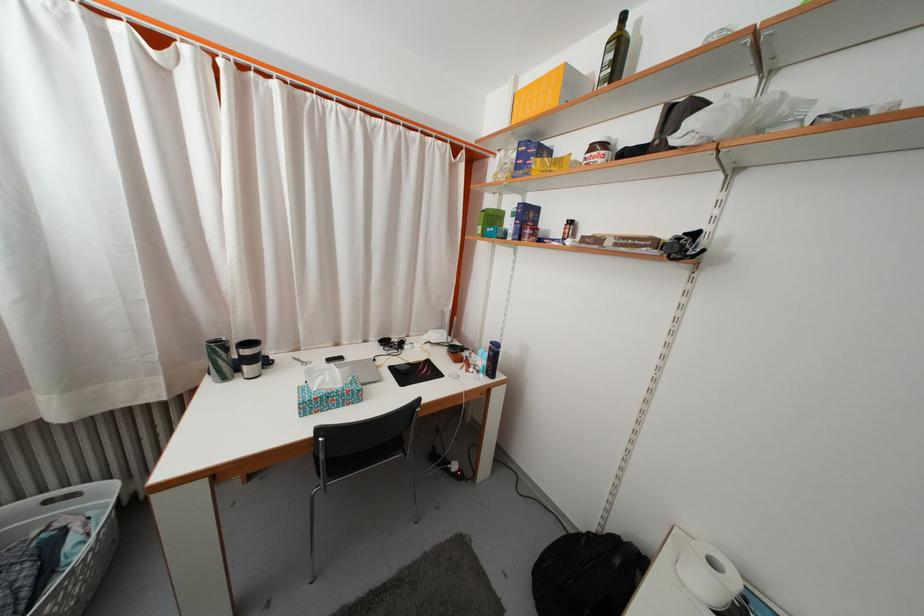
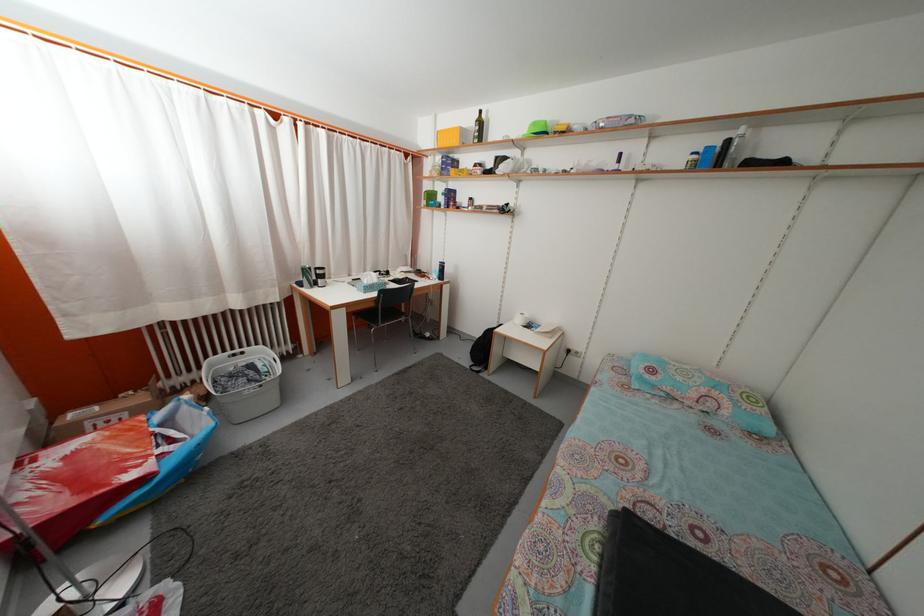
Where in the second image is the point corresponding to (575,84) from the first image?

(468, 139)